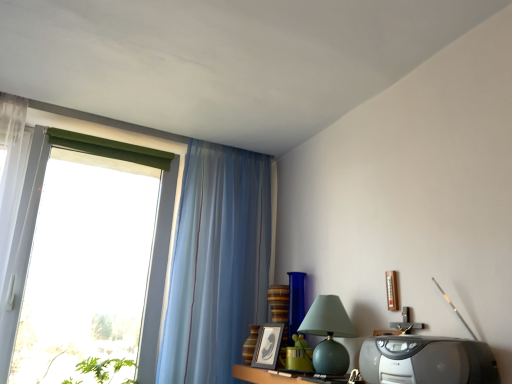
Question: Can you confirm if black matte picture frame at center is smaller than matte green glass table lamp at center-right?

Choices:
 (A) no
 (B) yes

Answer: (B)

Question: Could you tell me if black matte picture frame at center is facing matte green glass table lamp at center-right?

Choices:
 (A) no
 (B) yes

Answer: (A)

Question: Is black matte picture frame at center in contact with matte green glass table lamp at center-right?

Choices:
 (A) no
 (B) yes

Answer: (A)

Question: Is black matte picture frame at center outside matte green glass table lamp at center-right?

Choices:
 (A) no
 (B) yes

Answer: (B)

Question: Does black matte picture frame at center have a lesser height compared to matte green glass table lamp at center-right?

Choices:
 (A) yes
 (B) no

Answer: (A)

Question: Does point (288, 332) appear closer or farther from the camera than point (247, 344)?

Choices:
 (A) farther
 (B) closer

Answer: (A)

Question: In terms of size, does blue glass vase at center, acting as the first glass vase starting from the right, appear bigger or smaller than striped glass vase at center, acting as the 2th glass vase starting from the right?

Choices:
 (A) small
 (B) big

Answer: (B)

Question: Would you say blue glass vase at center, the 2th glass vase when ordered from left to right, is inside or outside striped glass vase at center, acting as the 2th glass vase starting from the right?

Choices:
 (A) outside
 (B) inside

Answer: (A)

Question: Is blue glass vase at center, the 2th glass vase when ordered from left to right, in front of or behind striped glass vase at center, the first glass vase from the left, in the image?

Choices:
 (A) behind
 (B) front

Answer: (A)

Question: From the image's perspective, is striped glass vase at center, acting as the 2th glass vase starting from the right, above or below translucent blue curtain at left?

Choices:
 (A) below
 (B) above

Answer: (A)

Question: Looking at their shapes, would you say striped glass vase at center, the first glass vase from the left, is wider or thinner than translucent blue curtain at left?

Choices:
 (A) thin
 (B) wide

Answer: (A)

Question: Is point (249, 360) closer or farther from the camera than point (215, 230)?

Choices:
 (A) farther
 (B) closer

Answer: (B)

Question: From a real-world perspective, relative to translucent blue curtain at left, is striped glass vase at center, the first glass vase from the left, vertically above or below?

Choices:
 (A) below
 (B) above

Answer: (A)

Question: From a real-world perspective, is wooden table at lower center positioned above or below translucent blue curtain at left?

Choices:
 (A) below
 (B) above

Answer: (A)

Question: Is wooden table at lower center spatially inside translucent blue curtain at left, or outside of it?

Choices:
 (A) inside
 (B) outside

Answer: (B)